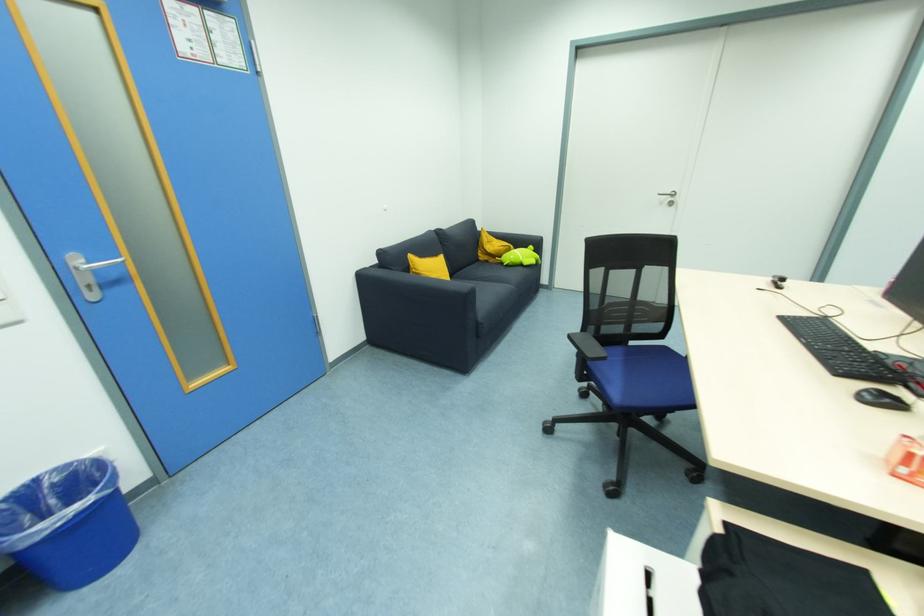
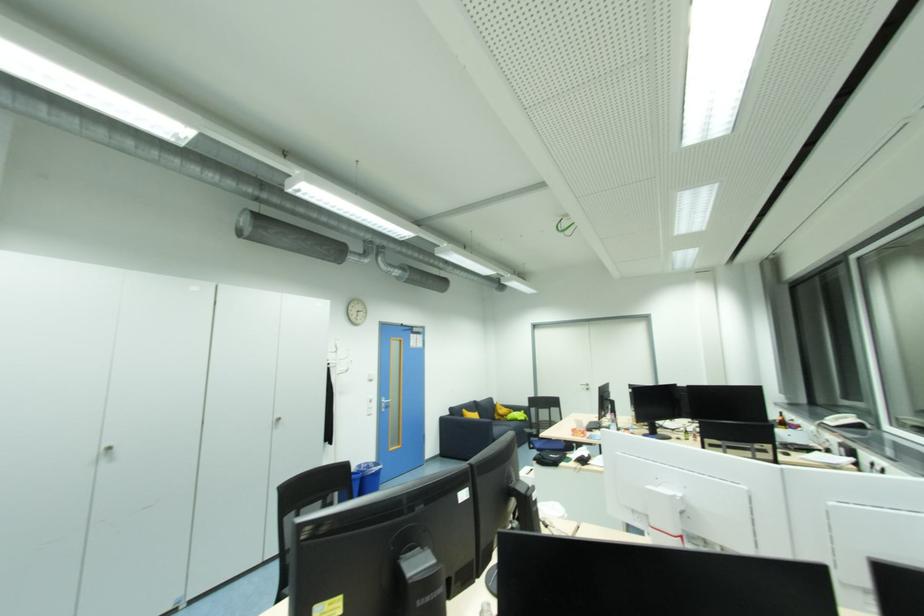
Locate, in the second image, the point that corresponds to the point at 533,248 in the first image.

(526, 413)